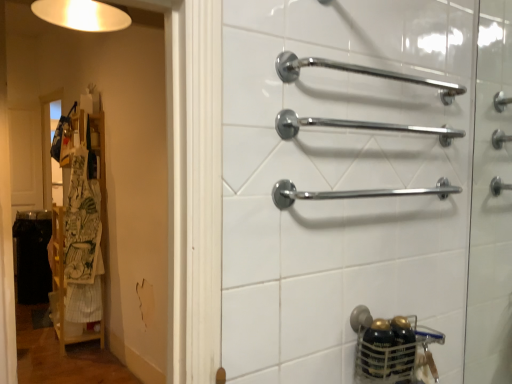
Question: Is chrome metallic towel rack at center, the second towel rack positioned from the top, not inside chrome metallic grab bars at right?

Choices:
 (A) yes
 (B) no

Answer: (A)

Question: Is chrome metallic towel rack at center, the 2th towel rack when ordered from bottom to top, smaller than chrome metallic grab bars at right?

Choices:
 (A) no
 (B) yes

Answer: (B)

Question: From the image's perspective, does chrome metallic towel rack at center, the second towel rack positioned from the top, appear higher than chrome metallic grab bars at right?

Choices:
 (A) yes
 (B) no

Answer: (A)

Question: Is chrome metallic towel rack at center, the 2th towel rack when ordered from bottom to top, oriented away from chrome metallic grab bars at right?

Choices:
 (A) yes
 (B) no

Answer: (B)

Question: Is chrome metallic towel rack at center, the 2th towel rack when ordered from bottom to top, wider than chrome metallic grab bars at right?

Choices:
 (A) yes
 (B) no

Answer: (A)

Question: From the image's perspective, is chrome metallic towel rack at upper center, the 3th towel rack in the bottom-to-top sequence, located above or below chrome metallic towel rack at center, the second towel rack positioned from the top?

Choices:
 (A) above
 (B) below

Answer: (A)

Question: Considering the positions of point click(351, 66) and point click(301, 122), is point click(351, 66) closer or farther from the camera than point click(301, 122)?

Choices:
 (A) farther
 (B) closer

Answer: (A)

Question: Would you say chrome metallic towel rack at upper center, the 3th towel rack in the bottom-to-top sequence, is inside or outside chrome metallic towel rack at center, the second towel rack positioned from the top?

Choices:
 (A) inside
 (B) outside

Answer: (B)

Question: Based on their sizes in the image, would you say chrome metallic towel rack at upper center, the 3th towel rack in the bottom-to-top sequence, is bigger or smaller than chrome metallic towel rack at center, the second towel rack positioned from the top?

Choices:
 (A) big
 (B) small

Answer: (B)

Question: In terms of size, does chrome metallic towel rack at upper center, the 3th towel rack in the bottom-to-top sequence, appear bigger or smaller than white cotton apron at left?

Choices:
 (A) big
 (B) small

Answer: (B)

Question: From the image's perspective, is chrome metallic towel rack at upper center, the 3th towel rack in the bottom-to-top sequence, located above or below white cotton apron at left?

Choices:
 (A) below
 (B) above

Answer: (B)

Question: Based on their positions, is chrome metallic towel rack at upper center, the 3th towel rack in the bottom-to-top sequence, located to the left or right of white cotton apron at left?

Choices:
 (A) left
 (B) right

Answer: (B)

Question: Is chrome metallic towel rack at upper center, positioned as the first towel rack in top-to-bottom order, inside the boundaries of white cotton apron at left, or outside?

Choices:
 (A) inside
 (B) outside

Answer: (B)

Question: Considering the positions of point (94, 263) and point (507, 76), is point (94, 263) closer or farther from the camera than point (507, 76)?

Choices:
 (A) farther
 (B) closer

Answer: (A)

Question: From a real-world perspective, is white cotton apron at left positioned above or below chrome metallic grab bars at right?

Choices:
 (A) below
 (B) above

Answer: (A)